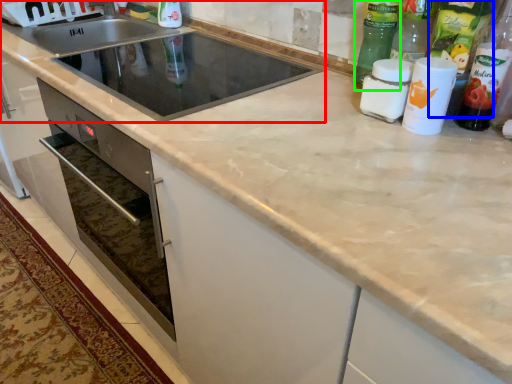
Question: Which object is positioned closest to sink (highlighted by a red box)? Select from bottle (highlighted by a blue box) and bottle (highlighted by a green box).

Choices:
 (A) bottle
 (B) bottle

Answer: (B)